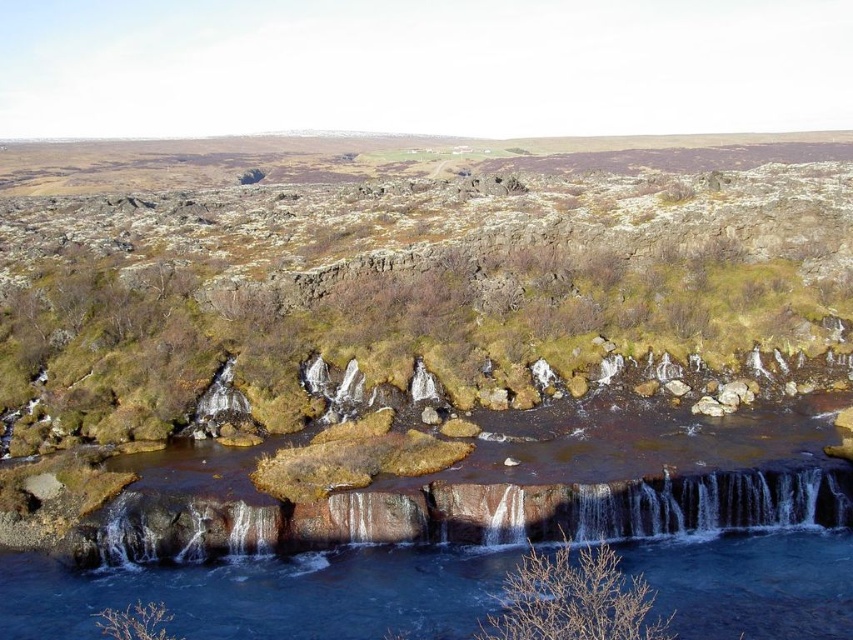
Question: Which point is farther to the camera?

Choices:
 (A) [630, 596]
 (B) [398, 518]
 (C) [256, 394]
 (D) [294, 595]

Answer: (C)

Question: Can you confirm if green mossy rock at center is smaller than smooth rock waterfall at center?

Choices:
 (A) yes
 (B) no

Answer: (B)

Question: Based on their relative distances, which object is farther from the smooth rock waterfall at center?

Choices:
 (A) brown dry branches at lower center
 (B) brown rock river at center

Answer: (A)

Question: Considering the relative positions of brown rock river at center and smooth rock waterfall at center in the image provided, where is brown rock river at center located with respect to smooth rock waterfall at center?

Choices:
 (A) above
 (B) below

Answer: (B)

Question: Does brown rock river at center appear on the right side of smooth rock waterfall at center?

Choices:
 (A) no
 (B) yes

Answer: (B)

Question: Considering the real-world distances, which object is closest to the brown rock river at center?

Choices:
 (A) brown dry branches at lower center
 (B) smooth rock waterfall at center
 (C) green mossy rock at center

Answer: (B)